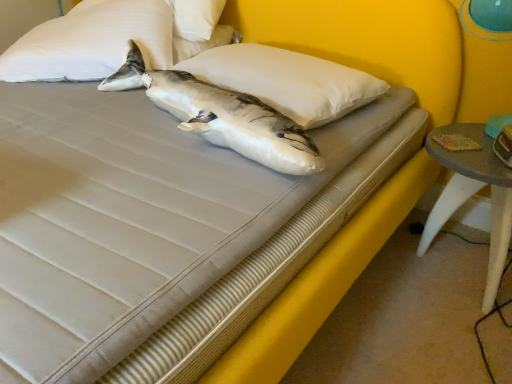
At what (x,y) coordinates should I click in order to perform the action: click on vacant space to the left of smooth gray table at lower right. Please return your answer as a coordinate pair (x, y). Image resolution: width=512 pixels, height=384 pixels. Looking at the image, I should click on (378, 294).